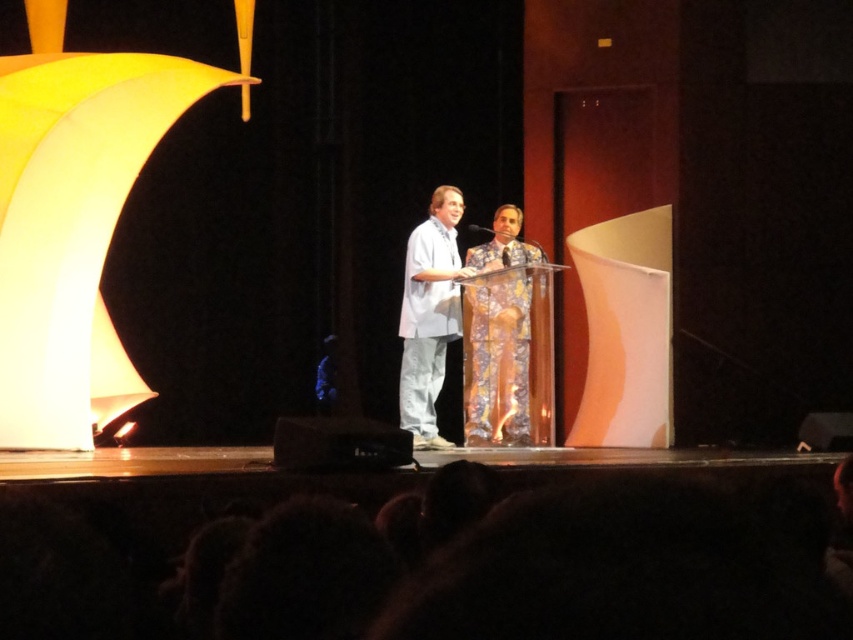
Question: Does floral-patterned suit at center have a greater width compared to white cotton shirt at center?

Choices:
 (A) yes
 (B) no

Answer: (A)

Question: Is floral-patterned suit at center wider than white cotton shirt at center?

Choices:
 (A) no
 (B) yes

Answer: (B)

Question: Among these points, which one is farthest from the camera?

Choices:
 (A) (456, 324)
 (B) (492, 428)

Answer: (A)

Question: Is floral-patterned suit at center thinner than white cotton shirt at center?

Choices:
 (A) no
 (B) yes

Answer: (A)